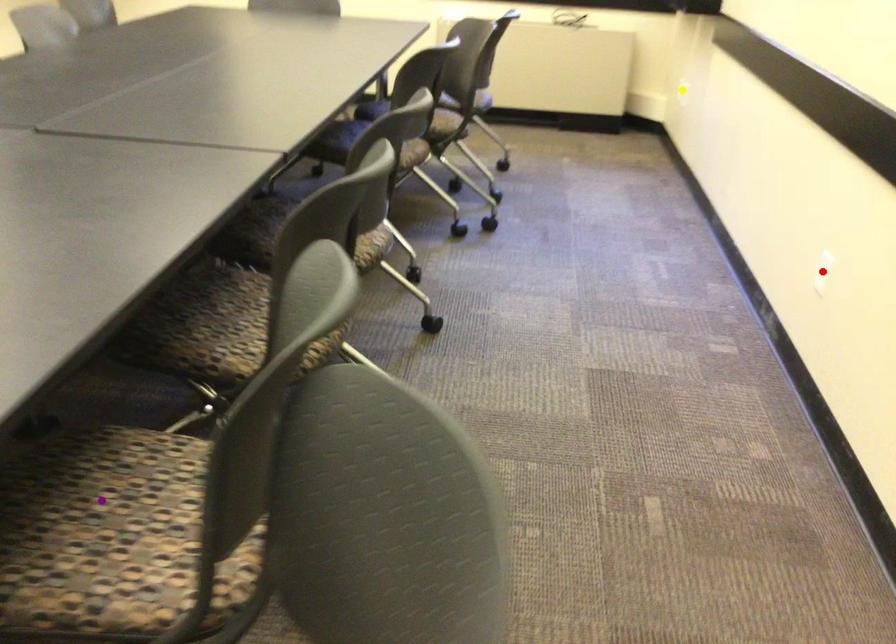
Order these from nearest to farthest:
A) purple point
B) red point
C) yellow point

purple point, red point, yellow point